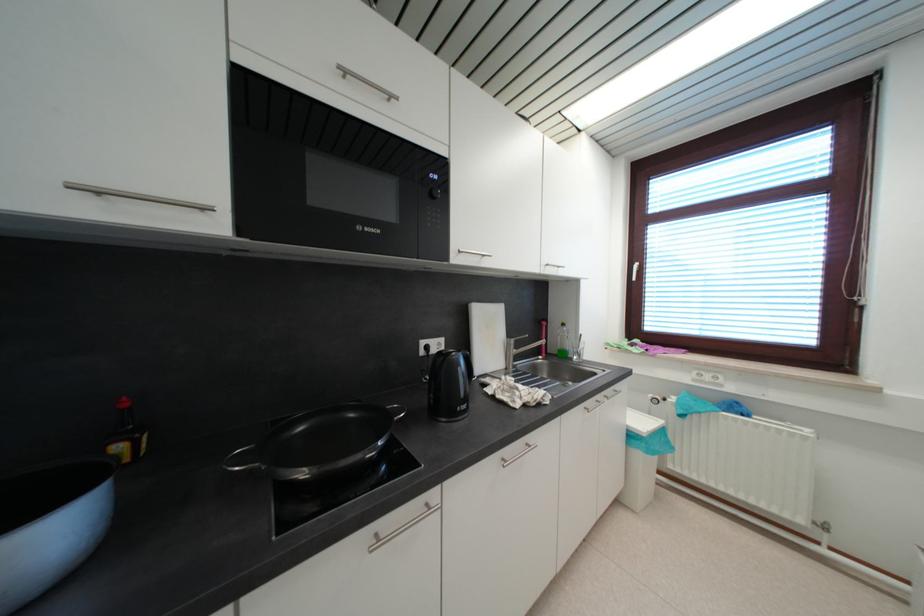
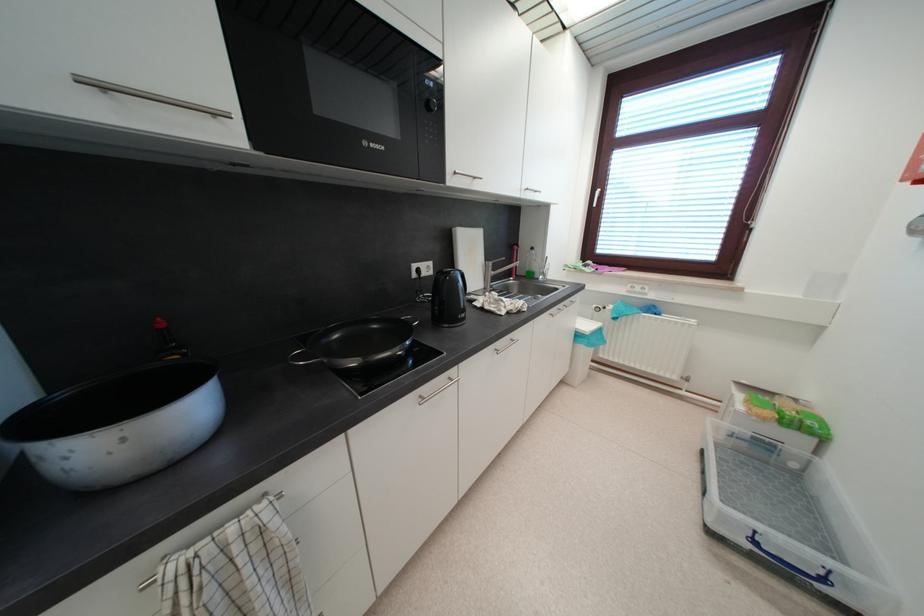
Where in the second image is the point corresponding to point 465,368 from the first image?

(464, 284)